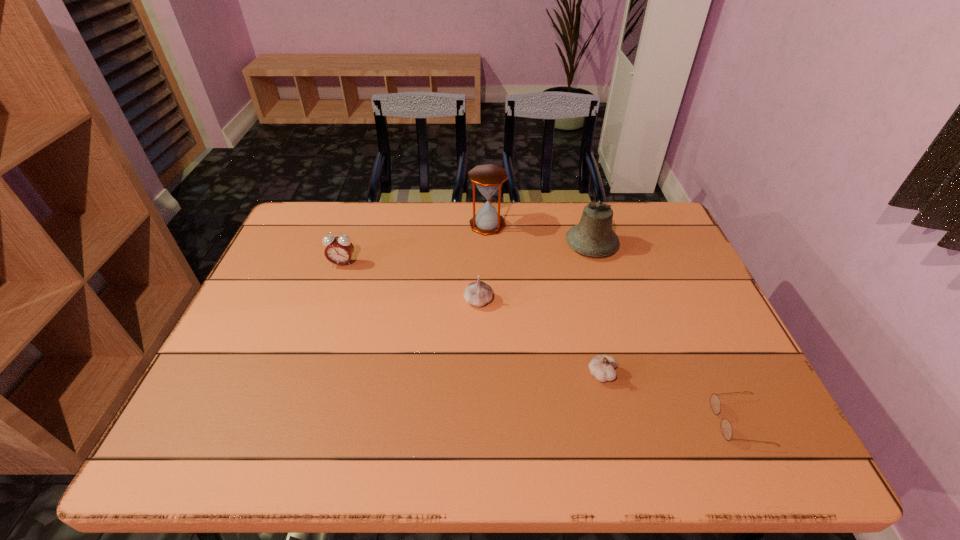
Find the location of a particular element. This screenshot has width=960, height=540. object that is at the near edge is located at coordinates (726, 428).

Locate an element on the screen. The height and width of the screenshot is (540, 960). object present at the right edge is located at coordinates (726, 428).

Where is `object that is at the near right corner`? The image size is (960, 540). object that is at the near right corner is located at coordinates (726, 428).

At what (x,y) coordinates should I click in order to perform the action: click on vacant space at the far edge. Please return your answer as a coordinate pair (x, y). The image size is (960, 540). Looking at the image, I should click on (361, 206).

This screenshot has height=540, width=960. Identify the location of blank space at the near edge. (310, 450).

This screenshot has width=960, height=540. I want to click on vacant space at the left edge, so click(x=311, y=292).

In the image, there is a desktop. Find the location of `free space at the right edge`. free space at the right edge is located at coordinates (669, 333).

The image size is (960, 540). What are the coordinates of `blank space at the far left corner of the desktop` in the screenshot? It's located at (320, 222).

You are a GUI agent. You are given a task and a screenshot of the screen. Output one action in this format:
    pyautogui.click(x=<x>, y=<y>)
    Task: Click on the vacant space at the near left corner
    The width and height of the screenshot is (960, 540).
    Given the screenshot: What is the action you would take?
    pyautogui.click(x=185, y=452)

In the image, there is a desktop. In order to click on blank space at the far right corner in this screenshot , I will do `click(654, 233)`.